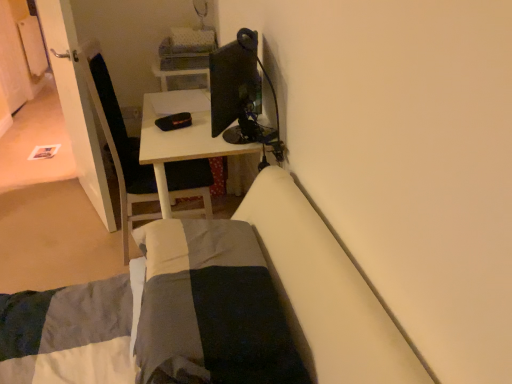
Question: Is dark gray cotton blanket at lower center turned away from white glossy desk at center?

Choices:
 (A) no
 (B) yes

Answer: (A)

Question: Can you confirm if dark gray cotton blanket at lower center is shorter than white glossy desk at center?

Choices:
 (A) yes
 (B) no

Answer: (A)

Question: From a real-world perspective, is dark gray cotton blanket at lower center positioned under white glossy desk at center based on gravity?

Choices:
 (A) no
 (B) yes

Answer: (A)

Question: Is dark gray cotton blanket at lower center next to white glossy desk at center and touching it?

Choices:
 (A) no
 (B) yes

Answer: (A)

Question: Does dark gray cotton blanket at lower center have a greater width compared to white glossy desk at center?

Choices:
 (A) yes
 (B) no

Answer: (B)

Question: Is dark gray cotton blanket at lower center taller or shorter than white glossy door at left?

Choices:
 (A) short
 (B) tall

Answer: (A)

Question: In the image, is dark gray cotton blanket at lower center positioned in front of or behind white glossy door at left?

Choices:
 (A) front
 (B) behind

Answer: (A)

Question: Looking at the image, does dark gray cotton blanket at lower center seem bigger or smaller compared to white glossy door at left?

Choices:
 (A) big
 (B) small

Answer: (B)

Question: Is dark gray cotton blanket at lower center wider or thinner than white glossy door at left?

Choices:
 (A) thin
 (B) wide

Answer: (B)

Question: Looking at their shapes, would you say white glossy desk at center is wider or thinner than matte black monitor at upper center?

Choices:
 (A) wide
 (B) thin

Answer: (A)

Question: In terms of height, does white glossy desk at center look taller or shorter compared to matte black monitor at upper center?

Choices:
 (A) tall
 (B) short

Answer: (A)

Question: Does point (160, 145) appear closer or farther from the camera than point (226, 54)?

Choices:
 (A) farther
 (B) closer

Answer: (A)

Question: From the image's perspective, is white glossy desk at center located above or below matte black monitor at upper center?

Choices:
 (A) above
 (B) below

Answer: (B)

Question: Is white glossy door at left in front of or behind dark gray cotton blanket at lower center in the image?

Choices:
 (A) front
 (B) behind

Answer: (B)

Question: Is point (66, 109) positioned closer to the camera than point (203, 354)?

Choices:
 (A) closer
 (B) farther

Answer: (B)